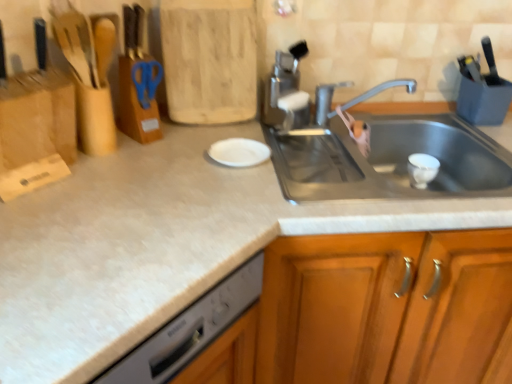
Question: Considering the relative sizes of silver metallic faucet at upper center and white matte plate at center in the image provided, is silver metallic faucet at upper center thinner than white matte plate at center?

Choices:
 (A) no
 (B) yes

Answer: (A)

Question: Is silver metallic faucet at upper center further to the viewer compared to white matte plate at center?

Choices:
 (A) yes
 (B) no

Answer: (A)

Question: Considering the relative sizes of silver metallic faucet at upper center and white matte plate at center in the image provided, is silver metallic faucet at upper center wider than white matte plate at center?

Choices:
 (A) yes
 (B) no

Answer: (A)

Question: Does silver metallic faucet at upper center lie in front of white matte plate at center?

Choices:
 (A) no
 (B) yes

Answer: (A)

Question: Does silver metallic faucet at upper center have a smaller size compared to white matte plate at center?

Choices:
 (A) no
 (B) yes

Answer: (A)

Question: From a real-world perspective, is white matte plate at center positioned above or below blue plastic scissors at upper center?

Choices:
 (A) below
 (B) above

Answer: (A)

Question: In terms of height, does white matte plate at center look taller or shorter compared to blue plastic scissors at upper center?

Choices:
 (A) tall
 (B) short

Answer: (B)

Question: Considering the positions of white matte plate at center and blue plastic scissors at upper center in the image, is white matte plate at center wider or thinner than blue plastic scissors at upper center?

Choices:
 (A) thin
 (B) wide

Answer: (B)

Question: From the image's perspective, is white matte plate at center above or below blue plastic scissors at upper center?

Choices:
 (A) below
 (B) above

Answer: (A)

Question: Based on their positions, is white matte plate at center located to the left or right of satin nickel faucet at upper center?

Choices:
 (A) left
 (B) right

Answer: (A)

Question: From a real-world perspective, is white matte plate at center above or below satin nickel faucet at upper center?

Choices:
 (A) above
 (B) below

Answer: (B)

Question: Based on their sizes in the image, would you say white matte plate at center is bigger or smaller than satin nickel faucet at upper center?

Choices:
 (A) small
 (B) big

Answer: (A)

Question: Looking at their shapes, would you say white matte plate at center is wider or thinner than satin nickel faucet at upper center?

Choices:
 (A) thin
 (B) wide

Answer: (B)

Question: Would you say blue plastic scissors at upper center is to the left or to the right of silver metallic faucet at upper center in the picture?

Choices:
 (A) right
 (B) left

Answer: (B)

Question: Considering the positions of blue plastic scissors at upper center and silver metallic faucet at upper center in the image, is blue plastic scissors at upper center taller or shorter than silver metallic faucet at upper center?

Choices:
 (A) tall
 (B) short

Answer: (B)